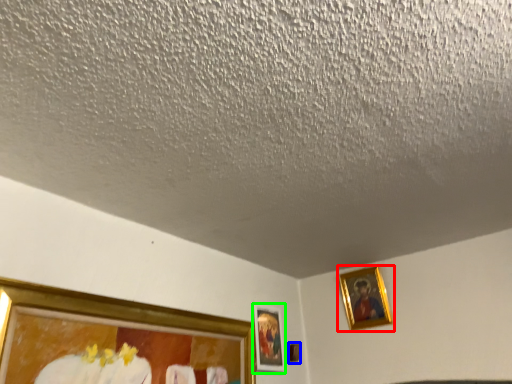
Question: Estimate the real-world distances between objects in this image. Which object is closer to picture frame (highlighted by a red box), picture frame (highlighted by a blue box) or picture frame (highlighted by a green box)?

Choices:
 (A) picture frame
 (B) picture frame

Answer: (A)